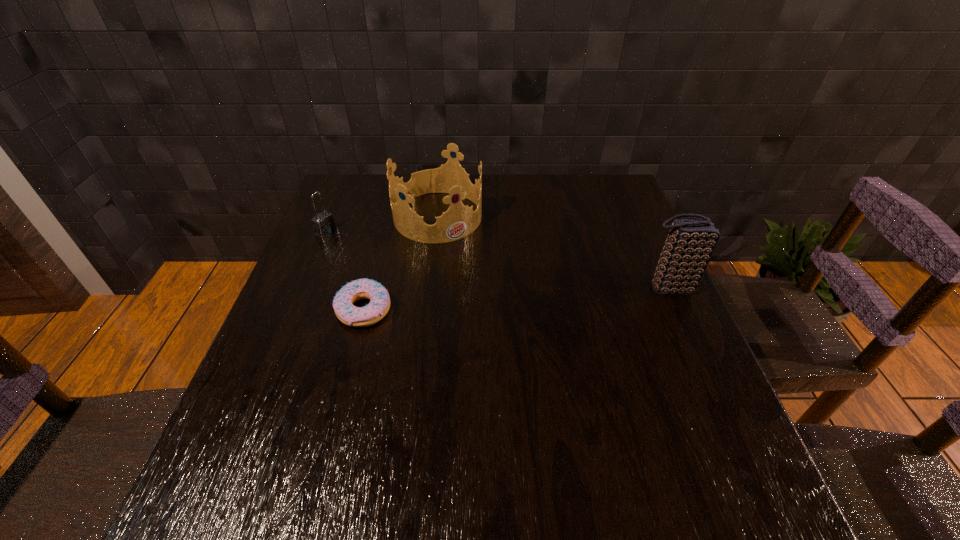
Where is `vacant point located between the padlock and the rightmost object`? vacant point located between the padlock and the rightmost object is located at coordinates (497, 260).

Locate an element on the screen. the closest object relative to the tiara is located at coordinates (324, 224).

Find the location of `object that stands as the second closest to the tallest object`. object that stands as the second closest to the tallest object is located at coordinates (346, 312).

Where is `free spot that satisfies the following two spatial constraints: 1. on the back side of the rightmost object; 2. with the zip open on the shortest object`? free spot that satisfies the following two spatial constraints: 1. on the back side of the rightmost object; 2. with the zip open on the shortest object is located at coordinates (370, 288).

Image resolution: width=960 pixels, height=540 pixels. Identify the location of vacant space that satisfies the following two spatial constraints: 1. on the front side of the leftmost object; 2. on the left side of the shortest object. (294, 310).

Where is `vacant space that satisfies the following two spatial constraints: 1. on the front side of the clutch bag; 2. with the zip open on the tiara`? The width and height of the screenshot is (960, 540). vacant space that satisfies the following two spatial constraints: 1. on the front side of the clutch bag; 2. with the zip open on the tiara is located at coordinates (429, 288).